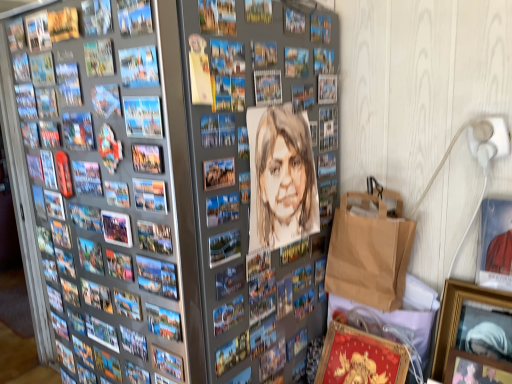
Describe the element at coordinates (476, 369) in the screenshot. Image resolution: width=512 pixels, height=384 pixels. I see `wooden picture frame at lower right, acting as the 3th picture frame starting from the right` at that location.

This screenshot has height=384, width=512. What do you see at coordinates (150, 195) in the screenshot? I see `metallic silver picture frame at center, which is counted as the fifth picture frame, starting from the right` at bounding box center [150, 195].

The height and width of the screenshot is (384, 512). What are the coordinates of `metallic silver picture frame at center, positioned as the 4th picture frame in right-to-left order` in the screenshot? It's located at (168, 363).

What do you see at coordinates (101, 188) in the screenshot? This screenshot has width=512, height=384. I see `watercolor portrait at center, the fourth comic book in the back-to-front sequence` at bounding box center [101, 188].

This screenshot has width=512, height=384. What do you see at coordinates (459, 316) in the screenshot?
I see `wooden picture frame at lower right, which appears as the first picture frame when viewed from the right` at bounding box center [459, 316].

Image resolution: width=512 pixels, height=384 pixels. Describe the element at coordinates (143, 116) in the screenshot. I see `matte paper comic book at center, marked as the first comic book in a left-to-right arrangement` at that location.

Where is `matte paper comic book at center, which appears as the second comic book when ordered from the bottom`? This screenshot has width=512, height=384. matte paper comic book at center, which appears as the second comic book when ordered from the bottom is located at coordinates (143, 116).

The width and height of the screenshot is (512, 384). In order to click on wooden picture frame at lower right, acting as the 3th picture frame starting from the right in this screenshot , I will do `click(476, 369)`.

Is matte red picture frame at upper right, marked as the second picture frame in a right-to-left arrangement, oriented away from wooden picture frame at lower right, acting as the 3th picture frame starting from the right?

No, matte red picture frame at upper right, marked as the second picture frame in a right-to-left arrangement, is not facing the opposite direction of wooden picture frame at lower right, acting as the 3th picture frame starting from the right.

Is matte red picture frame at upper right, marked as the second picture frame in a right-to-left arrangement, smaller than wooden picture frame at lower right, acting as the 3th picture frame starting from the right?

Actually, matte red picture frame at upper right, marked as the second picture frame in a right-to-left arrangement, might be larger than wooden picture frame at lower right, acting as the 3th picture frame starting from the right.

Between point (495, 260) and point (484, 378), which one is positioned in front?

Point (484, 378)

Consider the image. How many degrees apart are the facing directions of matte red picture frame at upper right, acting as the 5th picture frame starting from the left, and wooden picture frame at lower right, acting as the 3th picture frame starting from the right?

0.00203 degrees.

Is matte paper comic book at upper left, the 1th comic book in the top-to-bottom sequence, a part of matte paper comic book at center, which appears as the second comic book when ordered from the bottom?

No, matte paper comic book at upper left, the 1th comic book in the top-to-bottom sequence, is not inside matte paper comic book at center, which appears as the second comic book when ordered from the bottom.

Is matte paper comic book at center, which is the third comic book from top to bottom, wider or thinner than matte paper comic book at upper left, which is counted as the fourth comic book, starting from the bottom?

Clearly, matte paper comic book at center, which is the third comic book from top to bottom, has less width compared to matte paper comic book at upper left, which is counted as the fourth comic book, starting from the bottom.

From a real-world perspective, count 2nd comic books upward from the matte paper comic book at center, marked as the first comic book in a left-to-right arrangement, and point to it. Please provide its 2D coordinates.

[(134, 17)]

Which object is positioned more to the right, matte paper comic book at center, placed as the fourth comic book when sorted from front to back, or matte paper comic book at upper left, the 3th comic book when ordered from back to front?

matte paper comic book at upper left, the 3th comic book when ordered from back to front, is more to the right.

Is matte paper comic book at upper left, the second comic book when ordered from front to back, far away from blue paper comic book at upper left, the 3th comic book in the front-to-back sequence?

matte paper comic book at upper left, the second comic book when ordered from front to back, is near blue paper comic book at upper left, the 3th comic book in the front-to-back sequence, not far away.

Is point (132, 9) less distant than point (120, 60)?

Yes.

Can you tell me how much matte paper comic book at upper left, the second comic book in the right-to-left sequence, and blue paper comic book at upper left, the 2th comic book from the left, differ in facing direction?

0 degrees separate the facing orientations of matte paper comic book at upper left, the second comic book in the right-to-left sequence, and blue paper comic book at upper left, the 2th comic book from the left.

From a real-world perspective, is matte paper comic book at center, which is the third comic book from top to bottom, under blue paper comic book at upper left, the 2th comic book from the left?

Indeed, from a real-world perspective, matte paper comic book at center, which is the third comic book from top to bottom, is positioned beneath blue paper comic book at upper left, the 2th comic book from the left.

Is matte paper comic book at center, positioned as the fourth comic book in right-to-left order, to the left of blue paper comic book at upper left, placed as the 3th comic book when sorted from right to left, from the viewer's perspective?

Yes, matte paper comic book at center, positioned as the fourth comic book in right-to-left order, is to the left of blue paper comic book at upper left, placed as the 3th comic book when sorted from right to left.

Could you tell me if matte paper comic book at center, positioned as the fourth comic book in right-to-left order, is facing blue paper comic book at upper left, the 2th comic book from the left?

No, matte paper comic book at center, positioned as the fourth comic book in right-to-left order, does not turn towards blue paper comic book at upper left, the 2th comic book from the left.

Is wooden picture frame at lower right, which appears as the 4th picture frame when viewed from the left, taller or shorter than blue paper comic book at upper left, the 2th comic book from the top?

Clearly, wooden picture frame at lower right, which appears as the 4th picture frame when viewed from the left, is taller compared to blue paper comic book at upper left, the 2th comic book from the top.

Which of these two, wooden picture frame at lower right, which appears as the 4th picture frame when viewed from the left, or blue paper comic book at upper left, which is the 2th comic book in back-to-front order, is bigger?

wooden picture frame at lower right, which appears as the 4th picture frame when viewed from the left, is bigger.

Is point (492, 365) closer or farther from the camera than point (150, 56)?

Point (492, 365) is positioned farther from the camera compared to point (150, 56).

From a real-world perspective, is brown paper bag at lower right physically located above or below blue paper comic book at upper left, the 3th comic book in the front-to-back sequence?

brown paper bag at lower right is situated lower than blue paper comic book at upper left, the 3th comic book in the front-to-back sequence, in the real world.

Locate an element on the screen. The height and width of the screenshot is (384, 512). paper bag below the blue paper comic book at upper left, the 2th comic book from the top (from the image's perspective) is located at coordinates (370, 250).

Which point is more forward, (378, 304) or (149, 61)?

The point (149, 61) is in front.

Starting from the metallic silver picture frame at center, which appears as the sixth picture frame when viewed from the right, which picture frame is the 4th one to the right? Please provide its 2D coordinates.

[(495, 244)]

Consider the image. Is metallic silver picture frame at center, arranged as the first picture frame when viewed from the left, bigger than matte red picture frame at upper right, marked as the second picture frame in a right-to-left arrangement?

Incorrect, metallic silver picture frame at center, arranged as the first picture frame when viewed from the left, is not larger than matte red picture frame at upper right, marked as the second picture frame in a right-to-left arrangement.

Is metallic silver picture frame at center, arranged as the first picture frame when viewed from the left, inside or outside of matte red picture frame at upper right, acting as the 5th picture frame starting from the left?

metallic silver picture frame at center, arranged as the first picture frame when viewed from the left, is not enclosed by matte red picture frame at upper right, acting as the 5th picture frame starting from the left.

Which of these two, metallic silver picture frame at center, arranged as the first picture frame when viewed from the left, or matte red picture frame at upper right, acting as the 5th picture frame starting from the left, stands taller?

Standing taller between the two is matte red picture frame at upper right, acting as the 5th picture frame starting from the left.

The image size is (512, 384). In order to click on picture frame behind the matte red picture frame at upper right, acting as the 5th picture frame starting from the left in this screenshot , I will do `click(476, 369)`.

This screenshot has width=512, height=384. I want to click on comic book that is the 2nd one when counting forward from the matte paper comic book at center, placed as the fourth comic book when sorted from front to back, so click(x=134, y=17).

Based on their spatial positions, is matte red picture frame at upper right, marked as the second picture frame in a right-to-left arrangement, or watercolor portrait at center, the first comic book from the right, further from blue paper comic book at upper left, the 2th comic book from the left?

Among the two, matte red picture frame at upper right, marked as the second picture frame in a right-to-left arrangement, is located further to blue paper comic book at upper left, the 2th comic book from the left.

Estimate the real-world distances between objects in this image. Which object is further from matte paper comic book at center, placed as the first comic book when sorted from back to front, blue paper comic book at upper left, the 2th comic book from the top, or wooden picture frame at lower right, placed as the 6th picture frame when sorted from left to right?

wooden picture frame at lower right, placed as the 6th picture frame when sorted from left to right, is further to matte paper comic book at center, placed as the first comic book when sorted from back to front.

Based on their spatial positions, is metallic silver picture frame at center, arranged as the first picture frame when viewed from the left, or matte paper comic book at center, placed as the first comic book when sorted from back to front, closer to metallic silver picture frame at center, which is counted as the fifth picture frame, starting from the right?

Among the two, matte paper comic book at center, placed as the first comic book when sorted from back to front, is located nearer to metallic silver picture frame at center, which is counted as the fifth picture frame, starting from the right.

Consider the image. Which object lies further to the anchor point matte paper comic book at upper left, the 1th comic book in the top-to-bottom sequence, wooden picture frame at lower right, which appears as the 4th picture frame when viewed from the left, or metallic silver picture frame at center, acting as the third picture frame starting from the left?

Based on the image, wooden picture frame at lower right, which appears as the 4th picture frame when viewed from the left, appears to be further to matte paper comic book at upper left, the 1th comic book in the top-to-bottom sequence.

Which object lies nearer to the anchor point matte red picture frame at upper right, acting as the 5th picture frame starting from the left, metallic silver picture frame at center, arranged as the first picture frame when viewed from the left, or metallic silver picture frame at center, which is counted as the fifth picture frame, starting from the right?

Among the two, metallic silver picture frame at center, which is counted as the fifth picture frame, starting from the right, is located nearer to matte red picture frame at upper right, acting as the 5th picture frame starting from the left.

From the image, which object appears to be farther from wooden picture frame at lower right, which appears as the 4th picture frame when viewed from the left, matte red picture frame at upper right, marked as the second picture frame in a right-to-left arrangement, or matte paper comic book at upper left, the second comic book in the right-to-left sequence?

matte paper comic book at upper left, the second comic book in the right-to-left sequence.

Considering their positions, is wooden picture frame at lower right, which appears as the first picture frame when viewed from the right, positioned closer to blue paper comic book at upper left, the 3th comic book in the front-to-back sequence, than matte red picture frame at upper right, acting as the 5th picture frame starting from the left?

matte red picture frame at upper right, acting as the 5th picture frame starting from the left, lies closer to blue paper comic book at upper left, the 3th comic book in the front-to-back sequence, than the other object.

Looking at the image, which one is located closer to watercolor portrait at center, positioned as the first comic book in front-to-back order, metallic silver picture frame at center, acting as the 2th picture frame starting from the left, or brown paper bag at lower right?

metallic silver picture frame at center, acting as the 2th picture frame starting from the left, is positioned closer to the anchor watercolor portrait at center, positioned as the first comic book in front-to-back order.

Locate an element on the screen. picture frame between metallic silver picture frame at center, acting as the third picture frame starting from the left, and matte red picture frame at upper right, marked as the second picture frame in a right-to-left arrangement, from left to right is located at coordinates (476, 369).

Locate an element on the screen. This screenshot has width=512, height=384. comic book between matte paper comic book at center, marked as the first comic book in a left-to-right arrangement, and metallic silver picture frame at center, which appears as the sixth picture frame when viewed from the right, vertically is located at coordinates (101, 188).

Find the location of a particular element. The height and width of the screenshot is (384, 512). paper bag located between matte paper comic book at upper left, which ranks as the third comic book in left-to-right order, and matte red picture frame at upper right, acting as the 5th picture frame starting from the left, in the left-right direction is located at coordinates (370, 250).

The height and width of the screenshot is (384, 512). In order to click on comic book situated between matte paper comic book at upper left, which ranks as the third comic book in left-to-right order, and matte red picture frame at upper right, marked as the second picture frame in a right-to-left arrangement, from left to right in this screenshot , I will do `click(101, 188)`.